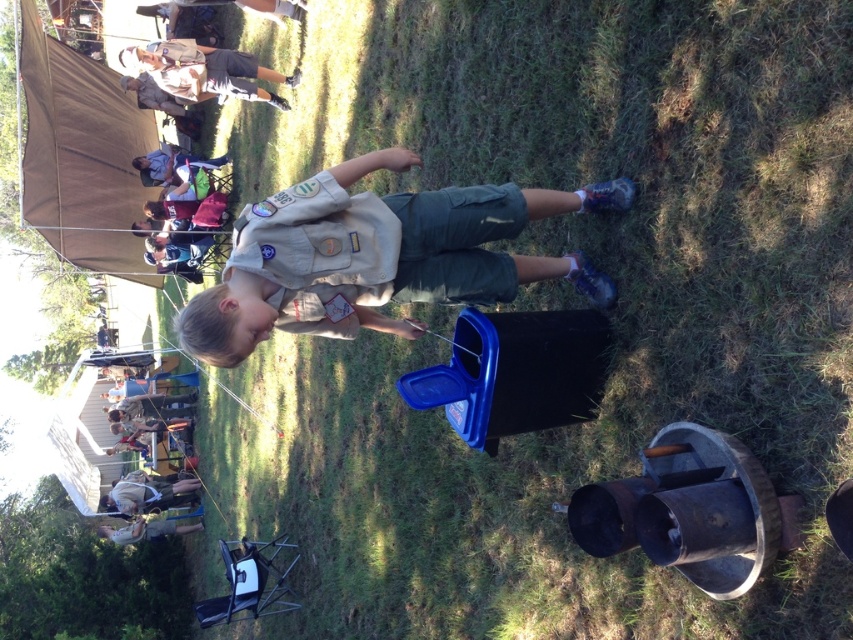
Does tan uniform at center appear under khaki uniform at upper left?

Yes, tan uniform at center is below khaki uniform at upper left.

Which is more to the right, tan uniform at center or khaki uniform at upper left?

tan uniform at center is more to the right.

Does point (447, 292) come behind point (215, 61)?

That is False.

Locate an element on the screen. tan uniform at center is located at coordinates (376, 257).

Does tan uniform at center appear on the left side of light brown wooden chair at lower left?

In fact, tan uniform at center is to the right of light brown wooden chair at lower left.

Does tan uniform at center appear on the right side of light brown wooden chair at lower left?

Indeed, tan uniform at center is positioned on the right side of light brown wooden chair at lower left.

The height and width of the screenshot is (640, 853). Find the location of `tan uniform at center`. tan uniform at center is located at coordinates (376, 257).

At what (x,y) coordinates should I click in order to perform the action: click on tan uniform at center. Please return your answer as a coordinate pair (x, y). This screenshot has height=640, width=853. Looking at the image, I should click on (376, 257).

Which is more to the right, khaki uniform at upper left or light brown leather jacket at lower left?

Positioned to the right is khaki uniform at upper left.

Who is taller, khaki uniform at upper left or light brown leather jacket at lower left?

With more height is khaki uniform at upper left.

This screenshot has height=640, width=853. What are the coordinates of `khaki uniform at upper left` in the screenshot? It's located at (206, 72).